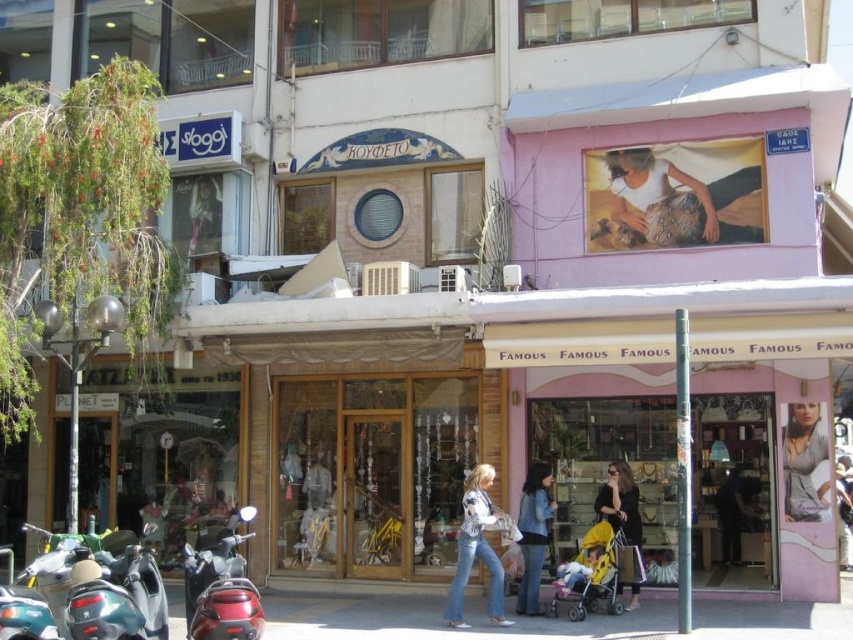
Question: Which point is closer to the camera?

Choices:
 (A) (190, 579)
 (B) (817, 468)
 (C) (724, 161)
 (D) (457, 573)

Answer: (A)

Question: Based on their relative distances, which object is farther from the shiny red motorcycle at lower left?

Choices:
 (A) denim jeans at center
 (B) matte white shirt at upper center

Answer: (B)

Question: Is matte white shirt at upper center wider than denim jeans at center?

Choices:
 (A) no
 (B) yes

Answer: (B)

Question: Does matte gray blouse at center appear under blue denim jeans at center?

Choices:
 (A) no
 (B) yes

Answer: (A)

Question: Which of the following is the farthest from the observer?

Choices:
 (A) coord(733,161)
 (B) coord(790,497)

Answer: (A)

Question: Can you confirm if matte white shirt at upper center is positioned above shiny red motorcycle at lower left?

Choices:
 (A) yes
 (B) no

Answer: (A)